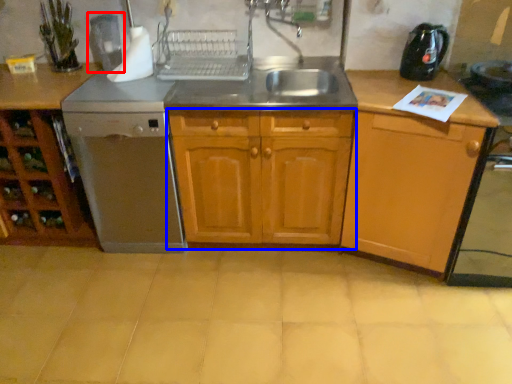
Question: Which object is closer to the camera taking this photo, coffee machine (highlighted by a red box) or cabinetry (highlighted by a blue box)?

Choices:
 (A) coffee machine
 (B) cabinetry

Answer: (B)